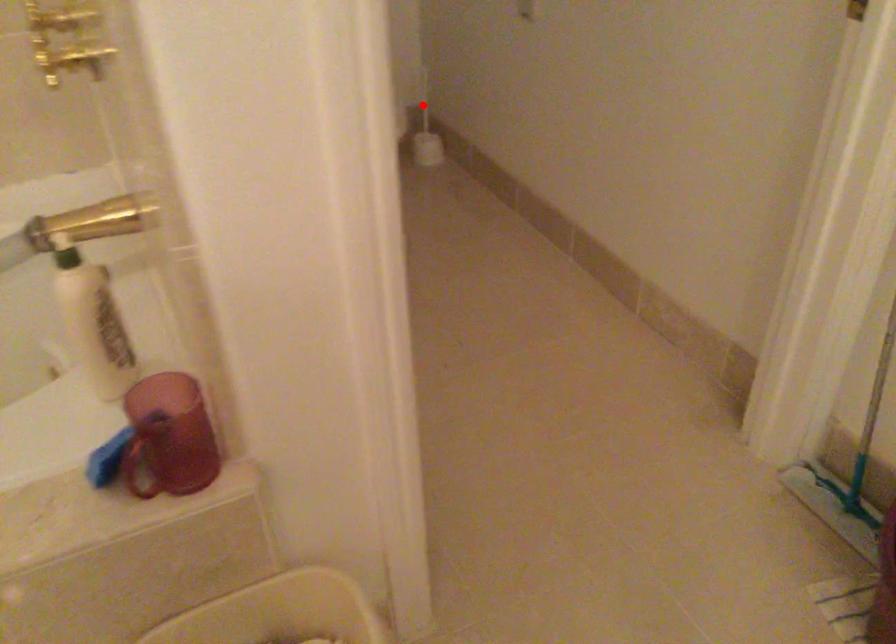
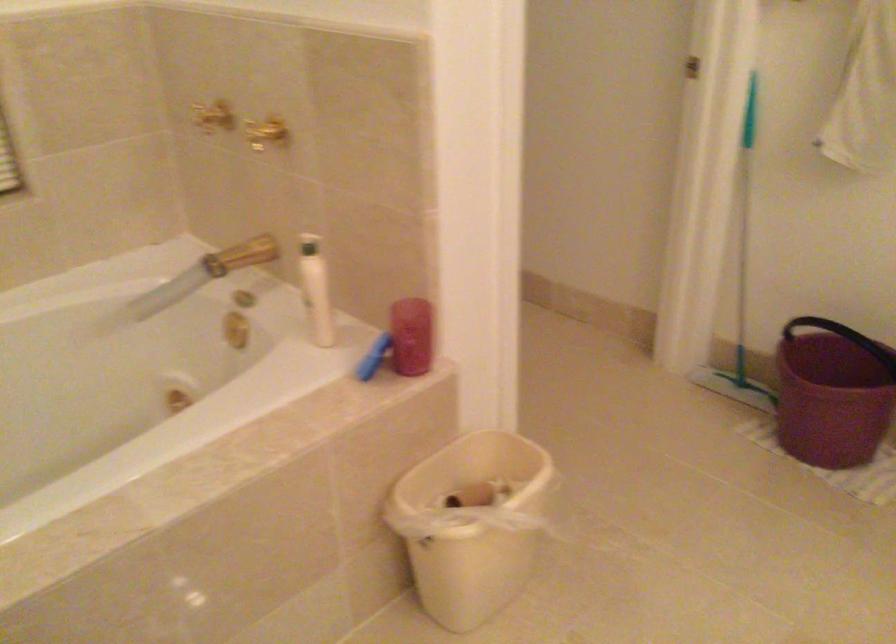
Question: I am providing you with two images of the same scene from different viewpoints. A red point is marked on the first image. Can you still see the location of the red point in image 2?

Choices:
 (A) Yes
 (B) No

Answer: (B)